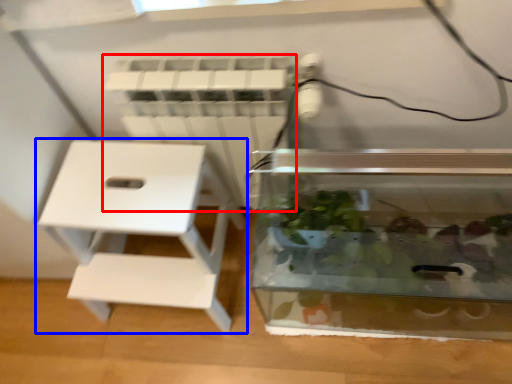
Question: Which object is further to the camera taking this photo, radiator (highlighted by a red box) or furniture (highlighted by a blue box)?

Choices:
 (A) radiator
 (B) furniture

Answer: (B)